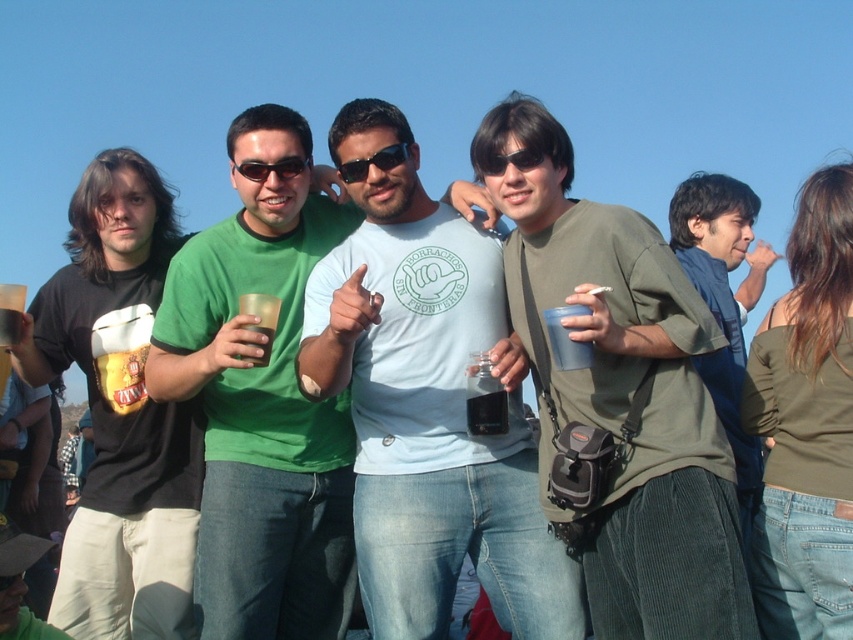
Question: Which point is farther to the camera?

Choices:
 (A) (492, 163)
 (B) (244, 310)

Answer: (A)

Question: Which point is farther to the camera?

Choices:
 (A) (351, 172)
 (B) (693, 202)
 (C) (560, 360)
 (D) (134, 384)

Answer: (B)

Question: Can you confirm if translucent plastic cup at center is positioned above black plastic sunglasses at center?

Choices:
 (A) yes
 (B) no

Answer: (B)

Question: Can you confirm if light blue t-shirt at center is bigger than translucent plastic cup at center?

Choices:
 (A) no
 (B) yes

Answer: (B)

Question: Estimate the real-world distances between objects in this image. Which object is farther from the translucent plastic cup at center?

Choices:
 (A) matte black t-shirt at left
 (B) matte green shirt at center
 (C) green matte shirt at center
 (D) light blue t-shirt at center

Answer: (A)

Question: Considering the relative positions of matte green shirt at center and transparent plastic cup at center in the image provided, where is matte green shirt at center located with respect to transparent plastic cup at center?

Choices:
 (A) right
 (B) left

Answer: (A)